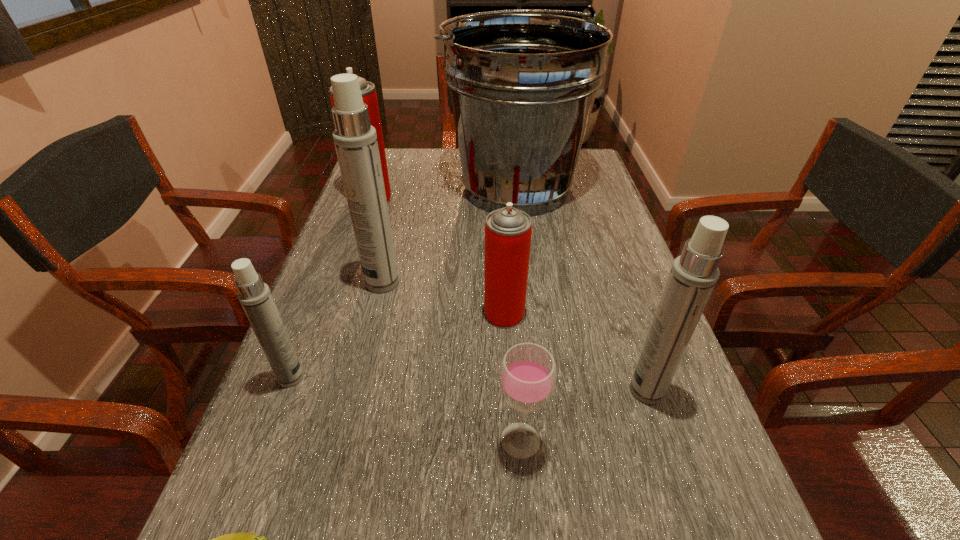
You are a GUI agent. You are given a task and a screenshot of the screen. Output one action in this format:
    pyautogui.click(x=<x>, y=<y>)
    Task: Click on the bucket
    
    Given the screenshot: What is the action you would take?
    pyautogui.click(x=522, y=85)

Find the location of `the biggest white aerosol can`. the biggest white aerosol can is located at coordinates (355, 140).

What are the coordinates of `the tallest aerosol can` in the screenshot? It's located at (355, 140).

Find the location of a particular element. the farther red aerosol can is located at coordinates (369, 95).

This screenshot has width=960, height=540. I want to click on the farthest aerosol can, so click(x=369, y=95).

This screenshot has height=540, width=960. In order to click on the rightmost white aerosol can in this screenshot , I will do pyautogui.click(x=693, y=275).

Where is `the second smallest white aerosol can`? The height and width of the screenshot is (540, 960). the second smallest white aerosol can is located at coordinates (693, 275).

Identify the location of the smaller red aerosol can. (508, 230).

Identify the location of the third nearest aerosol can. This screenshot has width=960, height=540. (508, 230).

Where is `the smallest white aerosol can`? The width and height of the screenshot is (960, 540). the smallest white aerosol can is located at coordinates pyautogui.click(x=255, y=297).